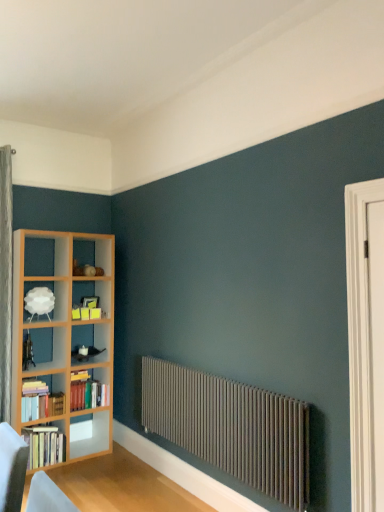
What is the approximate width of hardcover books at left, the 1th book when ordered from top to bottom?

hardcover books at left, the 1th book when ordered from top to bottom, is 16.74 centimeters in width.

Where is `white matte lampshade at upper left`? The image size is (384, 512). white matte lampshade at upper left is located at coordinates (45, 300).

What do you see at coordinates (44, 445) in the screenshot? The image size is (384, 512). I see `hardcover books at left, which ranks as the 3th book in top-to-bottom order` at bounding box center [44, 445].

Locate an element on the screen. The width and height of the screenshot is (384, 512). hardcover books at left, marked as the 3th book in a bottom-to-top arrangement is located at coordinates (40, 400).

Visually, is hardcover books at left, arranged as the 2th book when ordered from the bottom, positioned to the left or to the right of white wooden door at right?

hardcover books at left, arranged as the 2th book when ordered from the bottom, is to the left of white wooden door at right.

The width and height of the screenshot is (384, 512). Find the location of `the 1st book counting from the left of the white wooden door at right`. the 1st book counting from the left of the white wooden door at right is located at coordinates (87, 392).

Does hardcover books at left, which is counted as the second book, starting from the top, lie behind white wooden door at right?

Yes, the depth of hardcover books at left, which is counted as the second book, starting from the top, is greater than that of white wooden door at right.

Can you confirm if hardcover books at left, which is counted as the second book, starting from the top, is taller than white wooden door at right?

In fact, hardcover books at left, which is counted as the second book, starting from the top, may be shorter than white wooden door at right.

In terms of width, does hardcover books at left, which ranks as the 3th book in top-to-bottom order, look wider or thinner when compared to hardcover books at left, arranged as the 2th book when ordered from the bottom?

Considering their sizes, hardcover books at left, which ranks as the 3th book in top-to-bottom order, looks slimmer than hardcover books at left, arranged as the 2th book when ordered from the bottom.

The width and height of the screenshot is (384, 512). What are the coordinates of `the 2nd book counting from the right side of the hardcover books at left, positioned as the 1th book in bottom-to-top order` in the screenshot? It's located at (87, 392).

Who is taller, hardcover books at left, which ranks as the 3th book in top-to-bottom order, or hardcover books at left, arranged as the 2th book when ordered from the bottom?

With more height is hardcover books at left, which ranks as the 3th book in top-to-bottom order.

Is hardcover books at left, which ranks as the 3th book in top-to-bottom order, oriented away from hardcover books at left, marked as the 3th book in a bottom-to-top arrangement?

hardcover books at left, which ranks as the 3th book in top-to-bottom order, is not turned away from hardcover books at left, marked as the 3th book in a bottom-to-top arrangement.

From a real-world perspective, is hardcover books at left, which ranks as the 3th book in top-to-bottom order, physically above hardcover books at left, the 1th book when ordered from top to bottom?

A: Incorrect, from a real-world perspective, hardcover books at left, which ranks as the 3th book in top-to-bottom order, is lower than hardcover books at left, the 1th book when ordered from top to bottom.

Would you say hardcover books at left, which ranks as the 3th book in top-to-bottom order, is to the left or to the right of hardcover books at left, marked as the 3th book in a bottom-to-top arrangement, in the picture?

In the image, hardcover books at left, which ranks as the 3th book in top-to-bottom order, appears on the left side of hardcover books at left, marked as the 3th book in a bottom-to-top arrangement.

Is hardcover books at left, positioned as the 1th book in bottom-to-top order, far from hardcover books at left, the 1th book when ordered from top to bottom?

hardcover books at left, positioned as the 1th book in bottom-to-top order, is actually quite close to hardcover books at left, the 1th book when ordered from top to bottom.

Identify the location of book that appears above the hardcover books at left, which is counted as the second book, starting from the top (from the image's perspective). The height and width of the screenshot is (512, 384). (40, 400).

Which is in front, point (29, 402) or point (80, 379)?

Positioned in front is point (29, 402).

Based on the photo, in terms of height, does hardcover books at left, marked as the 3th book in a bottom-to-top arrangement, look taller or shorter compared to hardcover books at left, arranged as the 2th book when ordered from the bottom?

hardcover books at left, marked as the 3th book in a bottom-to-top arrangement, is shorter than hardcover books at left, arranged as the 2th book when ordered from the bottom.

Which of these two, hardcover books at left, the 1th book when ordered from top to bottom, or hardcover books at left, arranged as the 2th book when ordered from the bottom, is bigger?

Bigger between the two is hardcover books at left, arranged as the 2th book when ordered from the bottom.

Is hardcover books at left, arranged as the 2th book when ordered from the bottom, oriented towards hardcover books at left, the 1th book when ordered from top to bottom?

No, hardcover books at left, arranged as the 2th book when ordered from the bottom, does not turn towards hardcover books at left, the 1th book when ordered from top to bottom.

Relative to hardcover books at left, marked as the 3th book in a bottom-to-top arrangement, is hardcover books at left, which is counted as the second book, starting from the top, in front or behind?

In the image, hardcover books at left, which is counted as the second book, starting from the top, appears behind hardcover books at left, marked as the 3th book in a bottom-to-top arrangement.

Does hardcover books at left, which is counted as the second book, starting from the top, have a lesser height compared to hardcover books at left, the 1th book when ordered from top to bottom?

No.

From a real-world perspective, is hardcover books at left, which is counted as the second book, starting from the top, below hardcover books at left, marked as the 3th book in a bottom-to-top arrangement?

Actually, hardcover books at left, which is counted as the second book, starting from the top, is physically above hardcover books at left, marked as the 3th book in a bottom-to-top arrangement, in the real world.

Which is correct: hardcover books at left, which ranks as the 3th book in top-to-bottom order, is inside matte gray radiator at lower center, or outside of it?

The correct answer is: outside.

Which is less distant, (31, 429) or (192, 431)?

Point (31, 429) is farther from the camera than point (192, 431).

Considering the relative positions of hardcover books at left, positioned as the 1th book in bottom-to-top order, and matte gray radiator at lower center in the image provided, is hardcover books at left, positioned as the 1th book in bottom-to-top order, to the right of matte gray radiator at lower center from the viewer's perspective?

Incorrect, hardcover books at left, positioned as the 1th book in bottom-to-top order, is not on the right side of matte gray radiator at lower center.

Could you tell me if hardcover books at left, positioned as the 1th book in bottom-to-top order, is turned towards matte gray radiator at lower center?

Yes.

From the image's perspective, is white matte lampshade at upper left over hardcover books at left, arranged as the 2th book when ordered from the bottom?

Indeed, from the image's perspective, white matte lampshade at upper left is shown above hardcover books at left, arranged as the 2th book when ordered from the bottom.

How many degrees apart are the facing directions of white matte lampshade at upper left and hardcover books at left, which is counted as the second book, starting from the top?

2.99e-05 degrees separate the facing orientations of white matte lampshade at upper left and hardcover books at left, which is counted as the second book, starting from the top.

Between white matte lampshade at upper left and hardcover books at left, arranged as the 2th book when ordered from the bottom, which one has smaller width?

Thinner between the two is white matte lampshade at upper left.

In terms of size, does white matte lampshade at upper left appear bigger or smaller than hardcover books at left, arranged as the 2th book when ordered from the bottom?

Considering their sizes, white matte lampshade at upper left takes up less space than hardcover books at left, arranged as the 2th book when ordered from the bottom.

From a real-world perspective, count 1st books downward from the white wooden door at right and point to it. Please provide its 2D coordinates.

[(87, 392)]

Identify the location of the 2nd book in front of the hardcover books at left, which is counted as the second book, starting from the top, counting from the anchor's position. The height and width of the screenshot is (512, 384). (44, 445).

Which object lies further to the anchor point hardcover books at left, the 1th book when ordered from top to bottom, white wooden door at right or white matte lampshade at upper left?

white wooden door at right lies further to hardcover books at left, the 1th book when ordered from top to bottom, than the other object.

Looking at this image, which object lies further to the anchor point hardcover books at left, arranged as the 2th book when ordered from the bottom, hardcover books at left, the 1th book when ordered from top to bottom, or hardcover books at left, which ranks as the 3th book in top-to-bottom order?

hardcover books at left, which ranks as the 3th book in top-to-bottom order, is positioned further to the anchor hardcover books at left, arranged as the 2th book when ordered from the bottom.

Looking at the image, which one is located closer to white matte lampshade at upper left, white wooden door at right or hardcover books at left, the 1th book when ordered from top to bottom?

hardcover books at left, the 1th book when ordered from top to bottom, is positioned closer to the anchor white matte lampshade at upper left.

When comparing their distances from hardcover books at left, positioned as the 1th book in bottom-to-top order, does matte gray radiator at lower center or white matte lampshade at upper left seem further?

matte gray radiator at lower center is positioned further to the anchor hardcover books at left, positioned as the 1th book in bottom-to-top order.

Considering their positions, is hardcover books at left, which is counted as the second book, starting from the top, positioned closer to white wooden door at right than white matte lampshade at upper left?

The object closer to white wooden door at right is hardcover books at left, which is counted as the second book, starting from the top.

From the image, which object appears to be farther from white wooden door at right, hardcover books at left, the 1th book when ordered from top to bottom, or white matte lampshade at upper left?

hardcover books at left, the 1th book when ordered from top to bottom.

When comparing their distances from hardcover books at left, positioned as the 1th book in bottom-to-top order, does hardcover books at left, which is counted as the second book, starting from the top, or hardcover books at left, the 1th book when ordered from top to bottom, seem closer?

hardcover books at left, the 1th book when ordered from top to bottom.

Consider the image. From the image, which object appears to be nearer to white wooden door at right, matte gray radiator at lower center or hardcover books at left, marked as the 3th book in a bottom-to-top arrangement?

matte gray radiator at lower center.

Image resolution: width=384 pixels, height=512 pixels. I want to click on book between hardcover books at left, the 1th book when ordered from top to bottom, and hardcover books at left, positioned as the 1th book in bottom-to-top order, vertically, so click(x=87, y=392).

What are the coordinates of `book between hardcover books at left, marked as the 3th book in a bottom-to-top arrangement, and white wooden door at right from left to right` in the screenshot? It's located at (87, 392).

Locate an element on the screen. The width and height of the screenshot is (384, 512). radiator located between hardcover books at left, the 1th book when ordered from top to bottom, and white wooden door at right in the left-right direction is located at coordinates (231, 426).

I want to click on shelf between matte gray radiator at lower center and hardcover books at left, which is counted as the second book, starting from the top, from front to back, so click(45, 300).